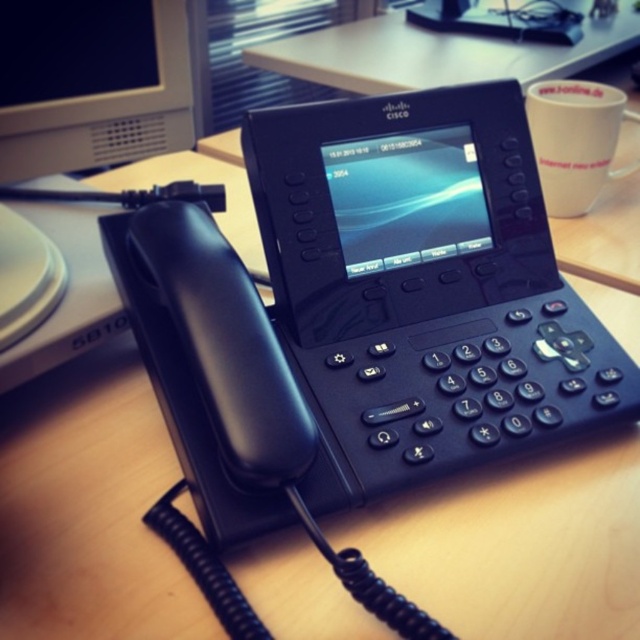
Question: Does wooden table at center appear on the right side of white glossy mug at upper right?

Choices:
 (A) no
 (B) yes

Answer: (B)

Question: Which point is closer to the camera taking this photo?

Choices:
 (A) (428, 72)
 (B) (557, 141)

Answer: (B)

Question: Does wooden table at center appear on the left side of white glossy mug at upper right?

Choices:
 (A) yes
 (B) no

Answer: (B)

Question: Can you confirm if wooden table at center is positioned to the right of white glossy mug at upper right?

Choices:
 (A) yes
 (B) no

Answer: (A)

Question: Which object is farther from the camera taking this photo?

Choices:
 (A) wooden table at center
 (B) white glossy mug at upper right

Answer: (A)

Question: Among these objects, which one is nearest to the camera?

Choices:
 (A) white glossy mug at upper right
 (B) wooden table at center

Answer: (A)